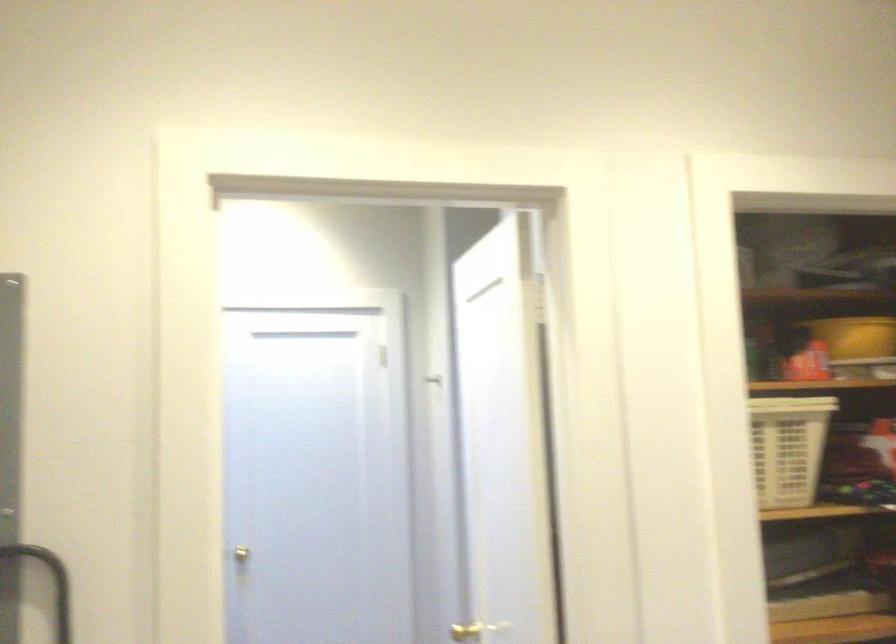
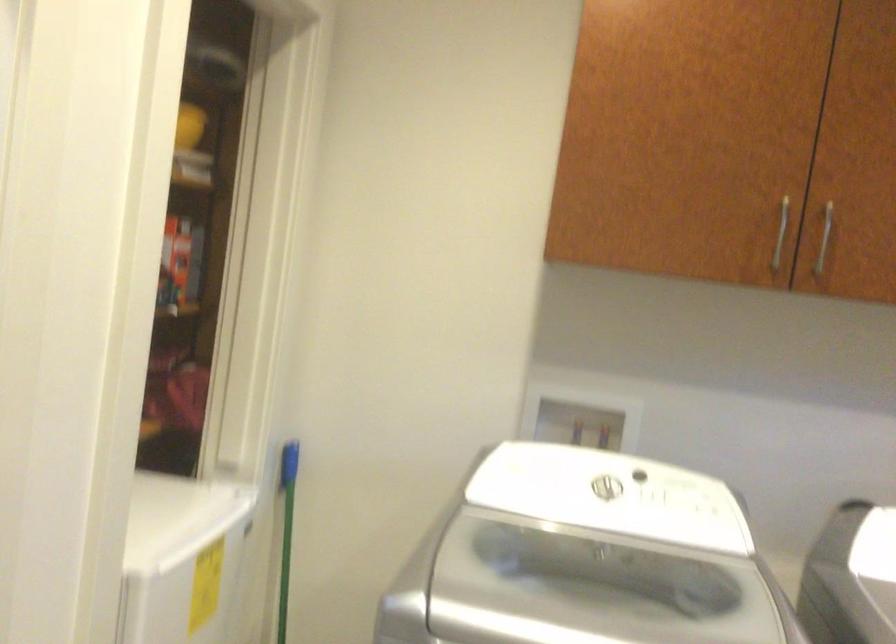
Question: The first image is from the beginning of the video and the second image is from the end. How did the camera likely rotate when shooting the video?

Choices:
 (A) Left
 (B) Right
 (C) Up
 (D) Down

Answer: (B)